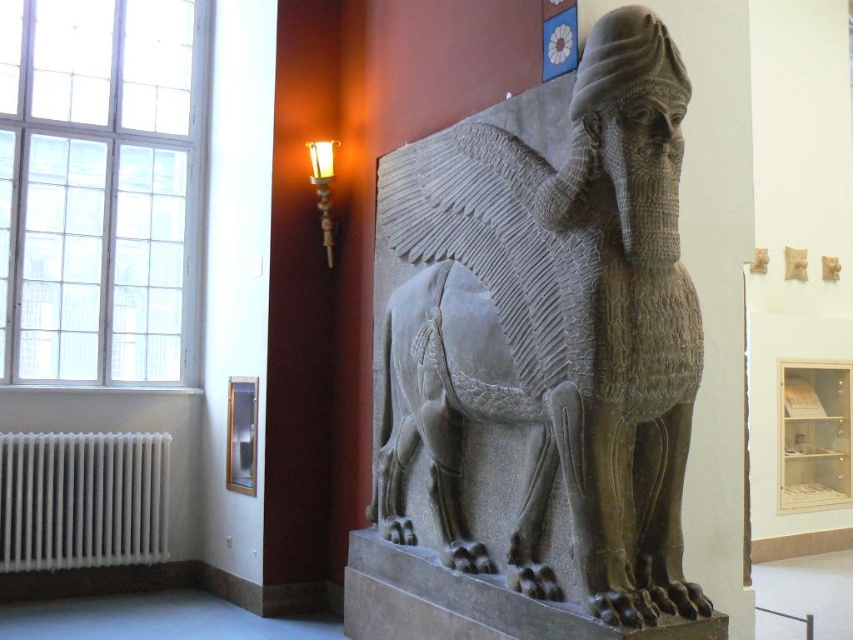
Does gray stone winged lion at center have a greater width compared to white metallic radiator at lower left?

Correct, the width of gray stone winged lion at center exceeds that of white metallic radiator at lower left.

Who is more forward, (490, 170) or (3, 468)?

Point (490, 170)

You are a GUI agent. You are given a task and a screenshot of the screen. Output one action in this format:
    pyautogui.click(x=<x>, y=<y>)
    Task: Click on the gray stone winged lion at center
    Image resolution: width=853 pixels, height=640 pixels.
    Given the screenshot: What is the action you would take?
    pyautogui.click(x=544, y=336)